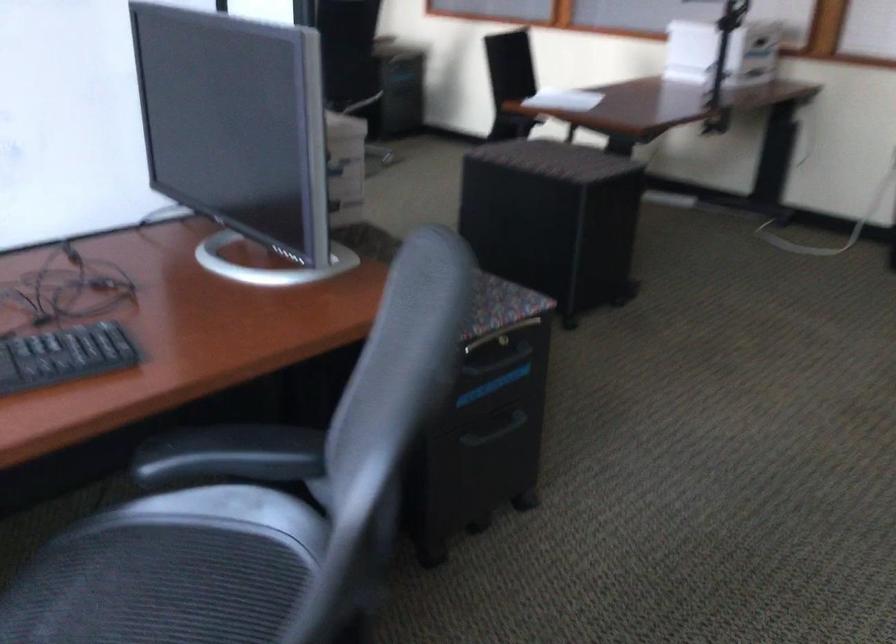
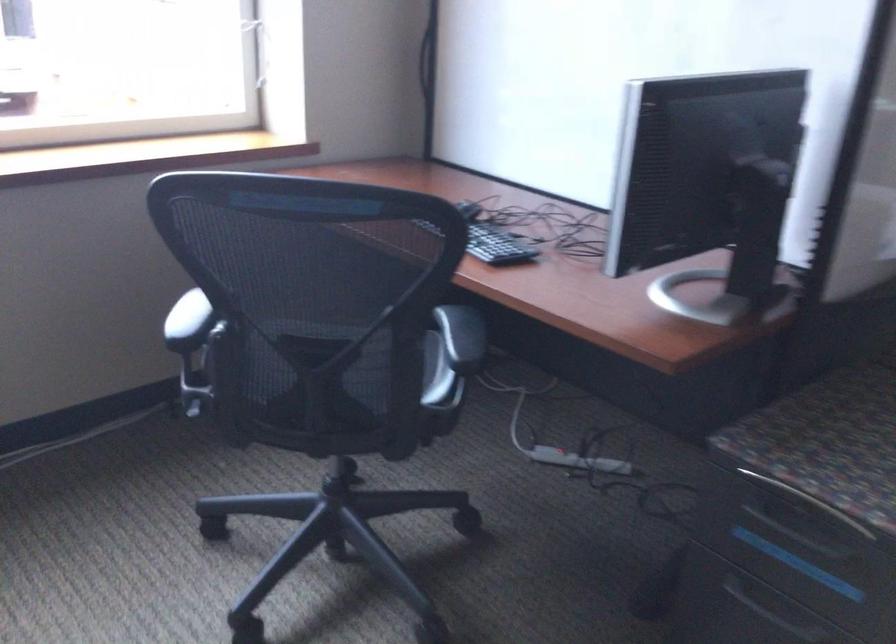
The point at (498, 430) is marked in the first image. Where is the corresponding point in the second image?

(778, 614)